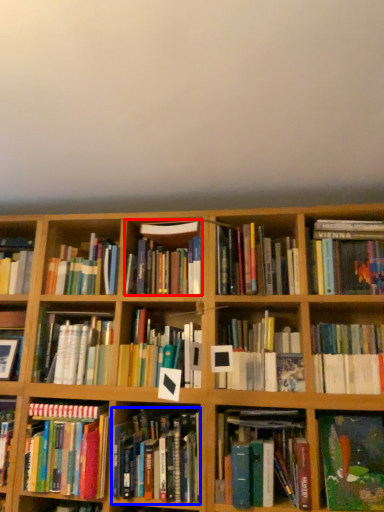
Question: Among these objects, which one is nearest to the camera, book (highlighted by a red box) or book (highlighted by a blue box)?

Choices:
 (A) book
 (B) book

Answer: (B)